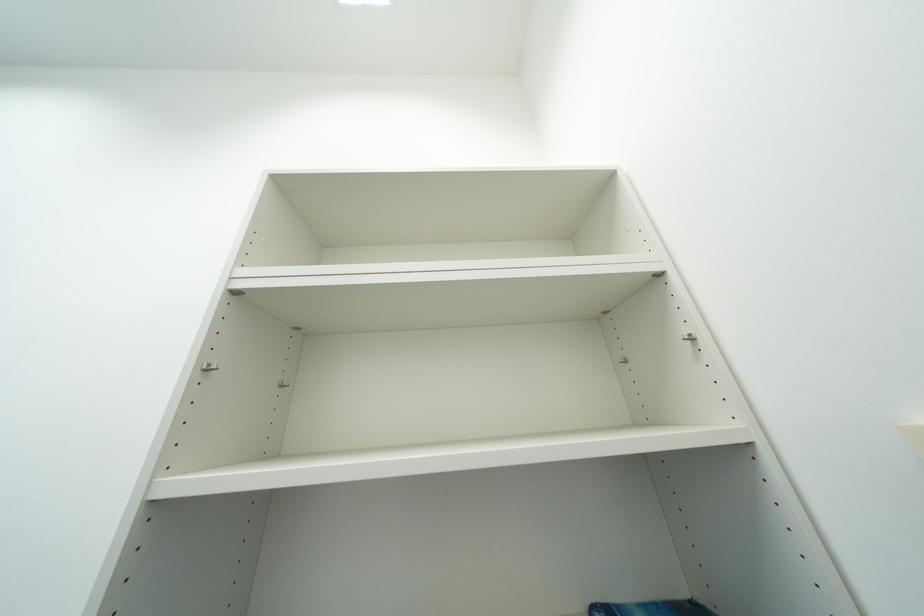
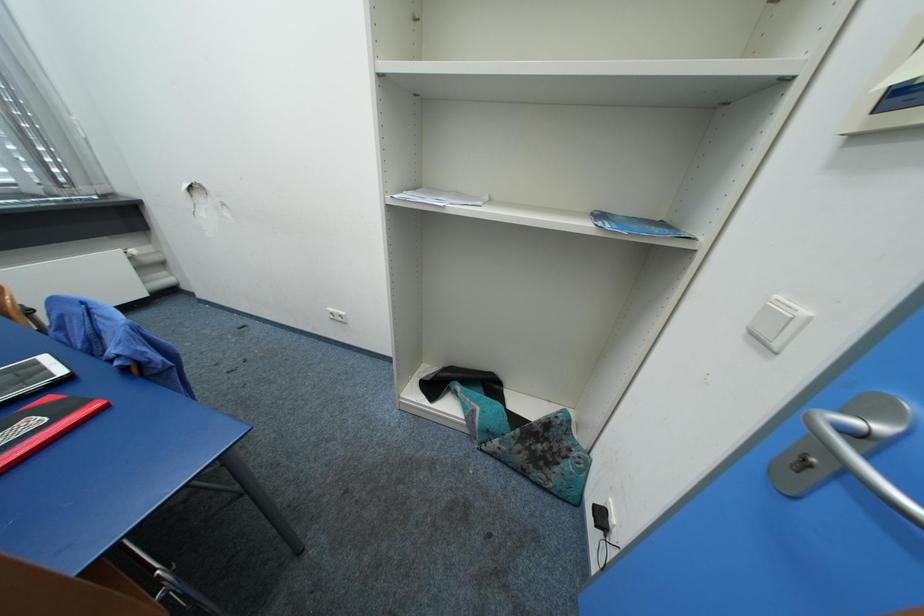
Based on the photo, first-person continuous shooting, in which direction is the camera rotating?

The rotation direction of the camera is left-down.